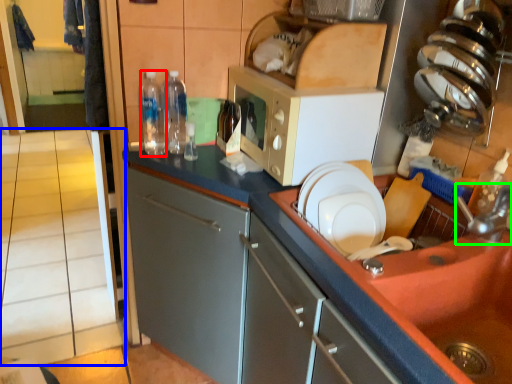
Question: Which object is positioned closest to bottle (highlighted by a red box)? Select from tile (highlighted by a blue box) and faucet (highlighted by a green box).

Choices:
 (A) tile
 (B) faucet

Answer: (B)